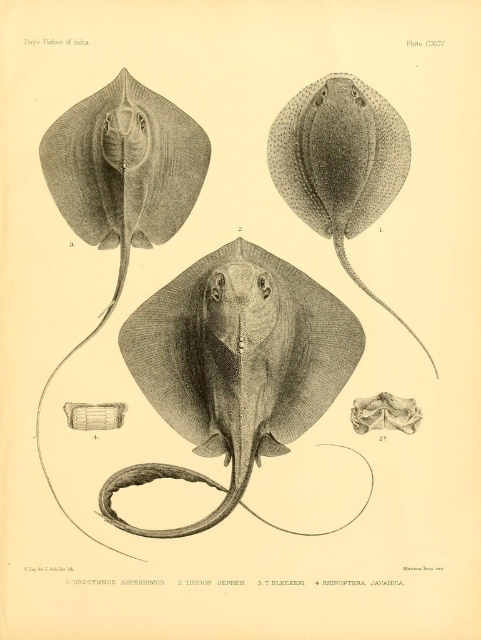
Question: Considering the real-world distances, which object is farthest from the gray textured stingray at center?

Choices:
 (A) gray textured stingray at upper left
 (B) smooth gray stingray at center

Answer: (B)

Question: Which point is farther to the camera?

Choices:
 (A) smooth gray stingray at center
 (B) gray textured stingray at upper left

Answer: (A)

Question: Is gray textured stingray at center thinner than gray textured stingray at upper left?

Choices:
 (A) no
 (B) yes

Answer: (A)

Question: Does gray textured stingray at center come behind smooth gray stingray at center?

Choices:
 (A) no
 (B) yes

Answer: (B)

Question: Which of the following is the closest to the observer?

Choices:
 (A) (203, 451)
 (B) (153, 97)
 (C) (323, 198)

Answer: (B)

Question: Does gray textured stingray at center come behind gray textured stingray at upper left?

Choices:
 (A) no
 (B) yes

Answer: (B)